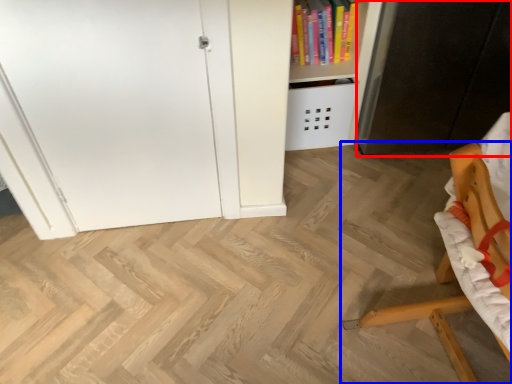
Question: Among these objects, which one is nearest to the camera, cabinetry (highlighted by a red box) or furniture (highlighted by a blue box)?

Choices:
 (A) cabinetry
 (B) furniture

Answer: (B)